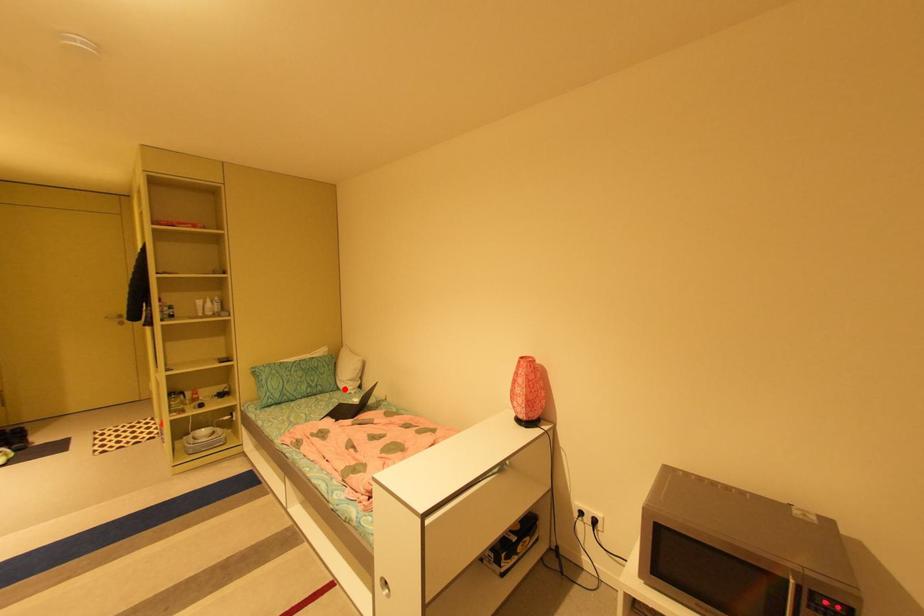
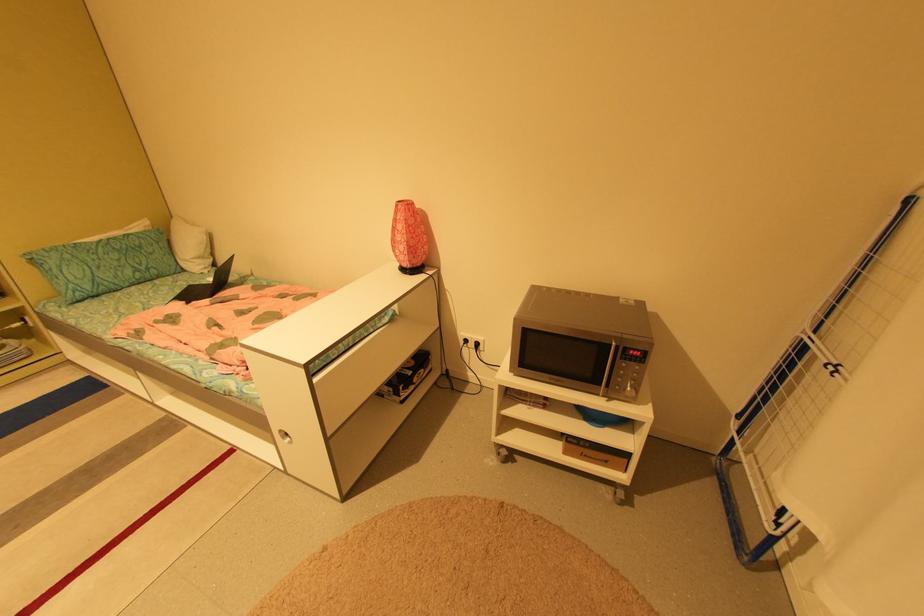
Find the pixel in the second image that matches the highlighted location in the first image.

(190, 270)